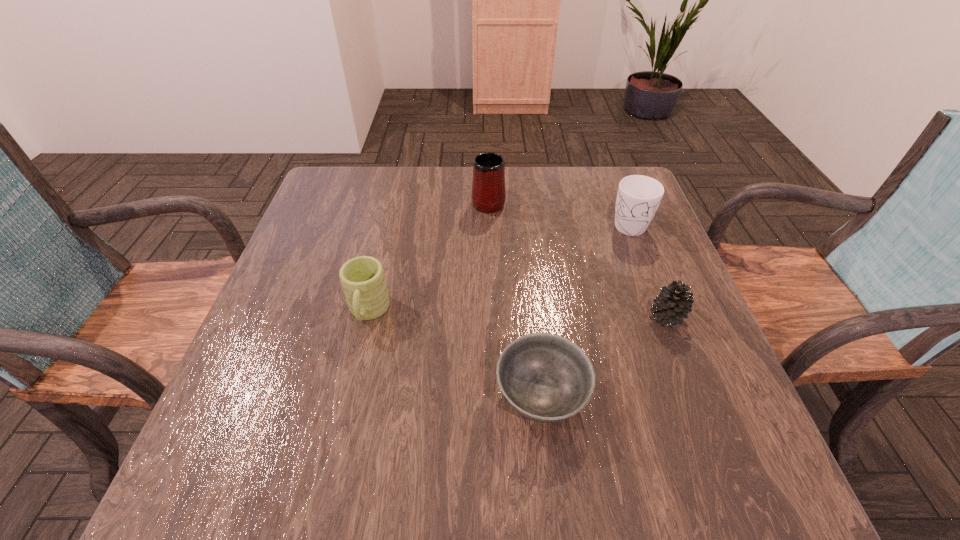
Where is `vacant area that lies between the second mug from right to left and the pinecone`? Image resolution: width=960 pixels, height=540 pixels. vacant area that lies between the second mug from right to left and the pinecone is located at coordinates (577, 259).

Where is `vacant space that's between the second mug from left to right and the rightmost mug`? vacant space that's between the second mug from left to right and the rightmost mug is located at coordinates (558, 212).

You are a GUI agent. You are given a task and a screenshot of the screen. Output one action in this format:
    pyautogui.click(x=<x>, y=<y>)
    Task: Click on the vacant point located between the rightmost mug and the second mug from left to right
    The height and width of the screenshot is (540, 960).
    Given the screenshot: What is the action you would take?
    (558, 212)

You are a GUI agent. You are given a task and a screenshot of the screen. Output one action in this format:
    pyautogui.click(x=<x>, y=<y>)
    Task: Click on the third closest object to the second mug from right to left
    This screenshot has height=540, width=960.
    Given the screenshot: What is the action you would take?
    pyautogui.click(x=673, y=304)

Point out which object is positioned as the third nearest to the shortest object. Please provide its 2D coordinates. Your answer should be formatted as a tuple, i.e. [(x, y)], where the tuple contains the x and y coordinates of a point satisfying the conditions above.

[(638, 197)]

You are a GUI agent. You are given a task and a screenshot of the screen. Output one action in this format:
    pyautogui.click(x=<x>, y=<y>)
    Task: Click on the mug that is the third closest to the pinecone
    The image size is (960, 540).
    Given the screenshot: What is the action you would take?
    pyautogui.click(x=364, y=285)

In order to click on the closest mug to the bowl in this screenshot , I will do `click(364, 285)`.

Find the location of a particular element. This screenshot has width=960, height=540. free spot that satisfies the following two spatial constraints: 1. on the side of the leftmost object with the handle; 2. on the left side of the shortest object is located at coordinates (348, 396).

Image resolution: width=960 pixels, height=540 pixels. I want to click on vacant space that satisfies the following two spatial constraints: 1. on the side of the leftmost mug with the handle; 2. on the left side of the shortest object, so click(x=348, y=396).

Where is `vacant point that satisfies the following two spatial constraints: 1. on the side of the nearest object with the handle; 2. on the right side of the leftmost object`? This screenshot has height=540, width=960. vacant point that satisfies the following two spatial constraints: 1. on the side of the nearest object with the handle; 2. on the right side of the leftmost object is located at coordinates (348, 396).